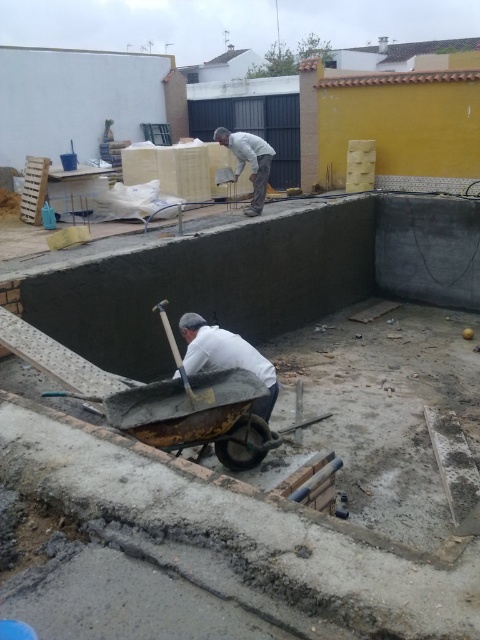
You are a construction worker standing at the edge of the basin. You need to move the rusty metal cart at center to the other side of the basin. Which direction should you move it relative to the white matte shirt at upper center?

The rusty metal cart at center is located below the white matte shirt at upper center. To move it to the other side of the basin, you should move it away from the white matte shirt at upper center.

You are standing at the entrance of the construction site, which is at point 0,0. You need to move the rusty metal cart at center to the storage area located at point 1,1. Based on its current position, can you determine if the cart is closer to the entrance or the storage area?

The rusty metal cart at center is located at point (196, 413). Since both coordinates are less than 1, it is closer to the entrance at (0, 0) than to the storage area at (479, 639). Therefore, the cart is closer to the entrance.

You are standing at the point marked as point [158,401]. You need to move to the concrete wheelbarrow at center. Which direction should you go?

The point [158,401] is the location of the concrete wheelbarrow at center, so you are already there.